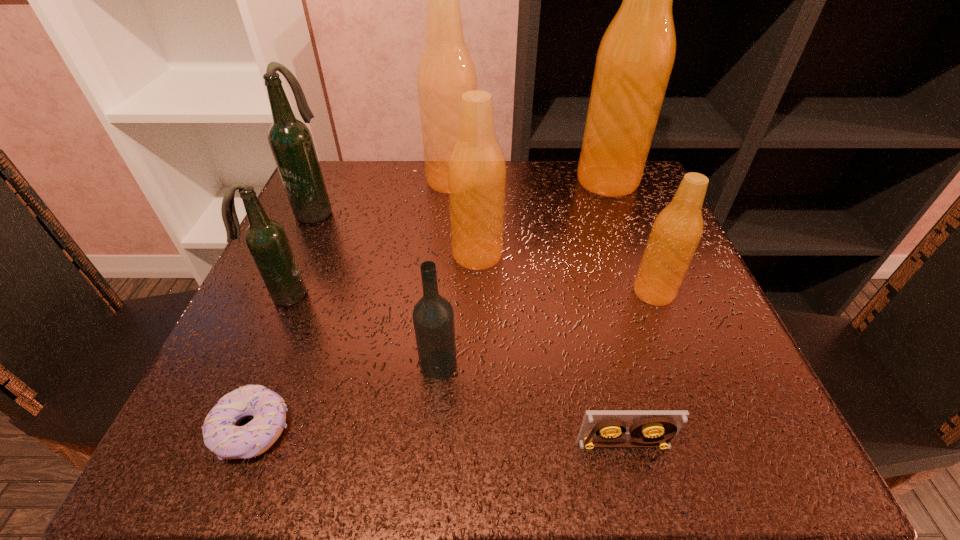
The image size is (960, 540). I want to click on free region located on the right of the nearer dark beer bottle, so click(406, 295).

Find the location of a particular element. This screenshot has width=960, height=540. blank area located on the right of the vodka is located at coordinates (612, 366).

Find the location of a particular element. vacant space located 0.170m on the back of the shortest object is located at coordinates (301, 306).

You are a GUI agent. You are given a task and a screenshot of the screen. Output one action in this format:
    pyautogui.click(x=<x>, y=<y>)
    Task: Click on the videotape situated at the near edge
    
    Given the screenshot: What is the action you would take?
    pyautogui.click(x=653, y=428)

The image size is (960, 540). Find the location of `doughnut situated at the near edge`. doughnut situated at the near edge is located at coordinates (222, 435).

In order to click on doughnut present at the left edge in this screenshot , I will do `click(222, 435)`.

Find the location of a particular element. This screenshot has width=960, height=540. videotape located at the right edge is located at coordinates pos(653,428).

Identify the location of object that is at the far left corner. (290, 140).

Where is `object situated at the near left corner`? The image size is (960, 540). object situated at the near left corner is located at coordinates (222, 435).

Find the location of `object that is at the far right corner`. object that is at the far right corner is located at coordinates (636, 55).